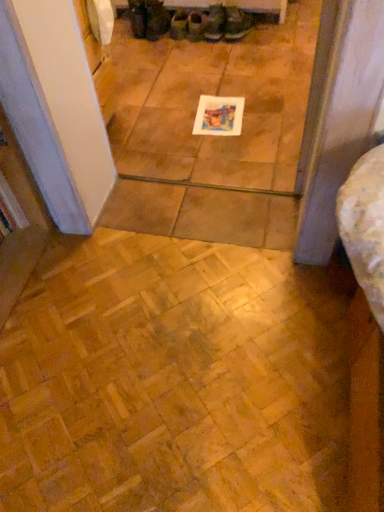
Where is `empty space that is ontop of white paper at center (from a real-world perspective)`? This screenshot has height=512, width=384. empty space that is ontop of white paper at center (from a real-world perspective) is located at coordinates (224, 115).